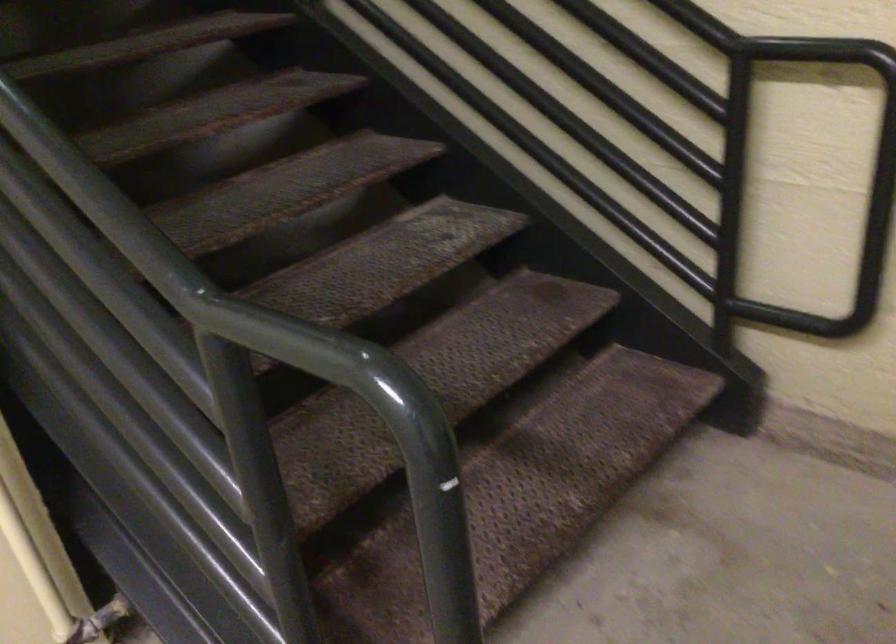
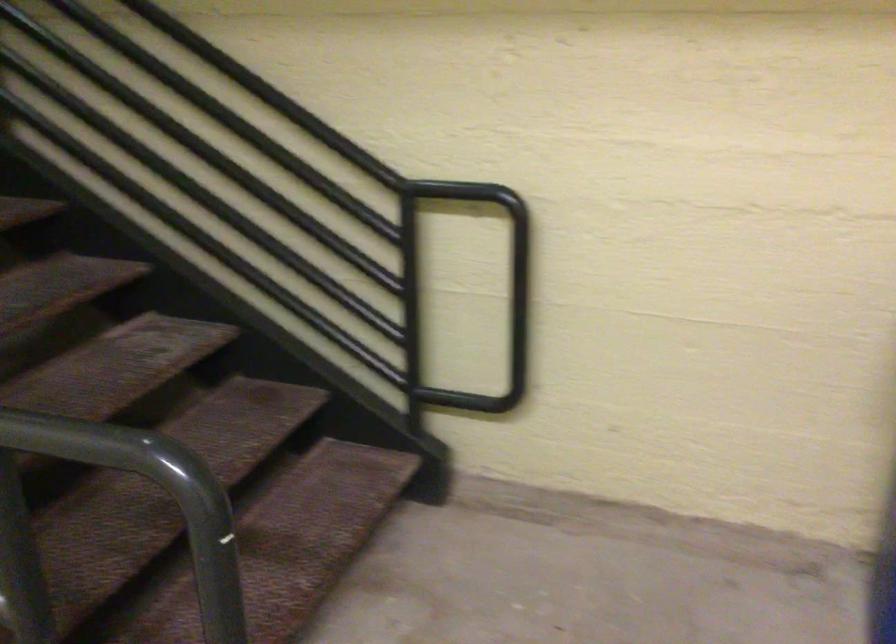
Which direction would the cameraman need to move to produce the second image?

The cameraman moved toward left, backward.